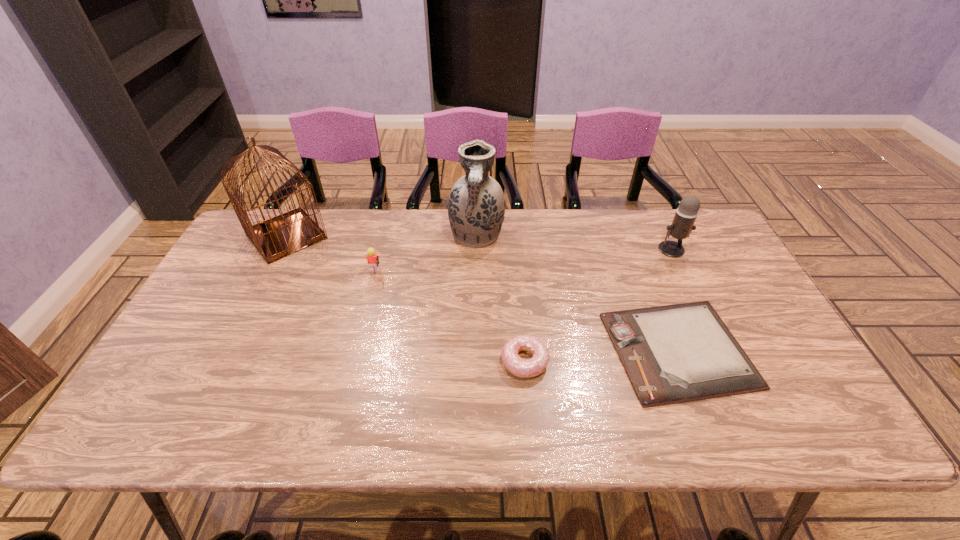
At what (x,y) coordinates should I click in order to perform the action: click on object present at the far left corner. Please return your answer as a coordinate pair (x, y). The image size is (960, 540). Looking at the image, I should click on (282, 235).

Find the location of `object that is at the far right corner`. object that is at the far right corner is located at coordinates (682, 225).

Identify the location of object that is at the near right corner. This screenshot has height=540, width=960. (677, 353).

Locate an element on the screen. vacant space at the far edge is located at coordinates (410, 233).

Image resolution: width=960 pixels, height=540 pixels. Identify the location of free spot at the near edge of the desktop. (681, 413).

At what (x,y) coordinates should I click in order to perform the action: click on blank space at the left edge of the desktop. Please return your answer as a coordinate pair (x, y). The image size is (960, 540). Looking at the image, I should click on (228, 306).

In the image, there is a desktop. Find the location of `vacant space at the right edge`. vacant space at the right edge is located at coordinates coord(710,259).

Image resolution: width=960 pixels, height=540 pixels. I want to click on free space between the leftmost object and the vase, so click(381, 236).

The height and width of the screenshot is (540, 960). Identify the location of free space between the third tallest object and the clipboard. (675, 300).

Locate an element on the screen. free space between the fourth shortest object and the shortest object is located at coordinates (675, 300).